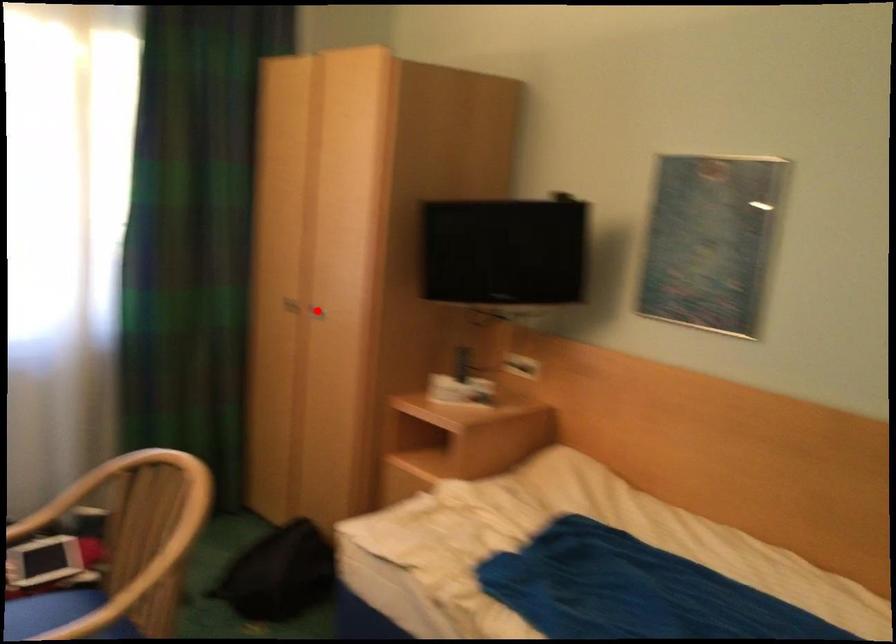
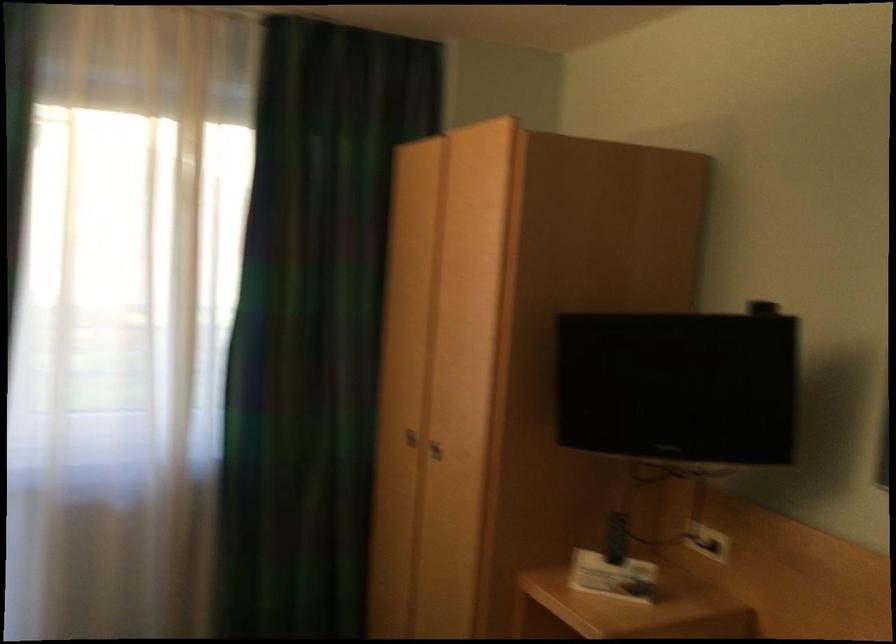
Question: I am providing you with two images of the same scene from different viewpoints. A red point is marked on the first image. Is the red point's position out of view in image 2?

Choices:
 (A) Yes
 (B) No

Answer: (B)